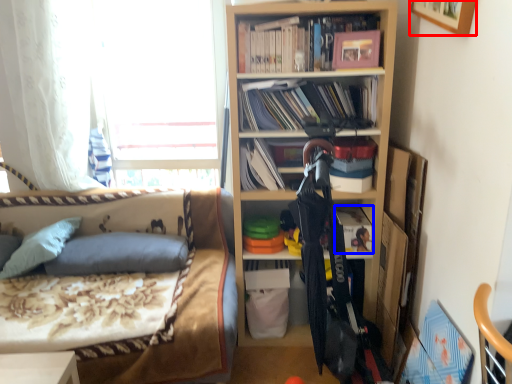
Question: Among these objects, which one is farthest to the camera, picture frame (highlighted by a red box) or book (highlighted by a blue box)?

Choices:
 (A) picture frame
 (B) book

Answer: (B)